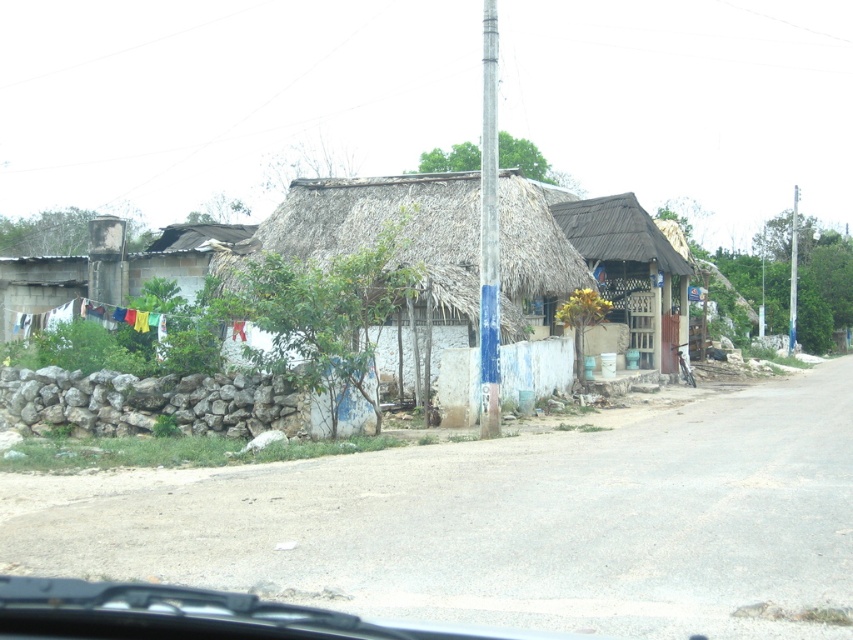
Is thatched roof hut at center shorter than smooth gray pole at right?

Correct, thatched roof hut at center is not as tall as smooth gray pole at right.

Which of these two, thatched roof hut at center or smooth gray pole at right, stands shorter?

thatched roof hut at center is shorter.

Image resolution: width=853 pixels, height=640 pixels. Identify the location of thatched roof hut at center. (631, 272).

The width and height of the screenshot is (853, 640). Find the location of `thatched roof hut at center`. thatched roof hut at center is located at coordinates [x=631, y=272].

Which is below, white thatch hut at center or thatched roof hut at center?

thatched roof hut at center is lower down.

Between point (368, 230) and point (616, 308), which one is positioned in front?

Point (368, 230) is more forward.

Identify the location of white thatch hut at center. (386, 227).

The height and width of the screenshot is (640, 853). I want to click on thatched roof hut at center, so click(x=631, y=272).

Does thatched roof hut at center have a larger size compared to blue painted metal pole at center?

Actually, thatched roof hut at center might be smaller than blue painted metal pole at center.

Is point (637, 264) behind point (492, 337)?

Yes, it is behind point (492, 337).

Identify the location of thatched roof hut at center. (631, 272).